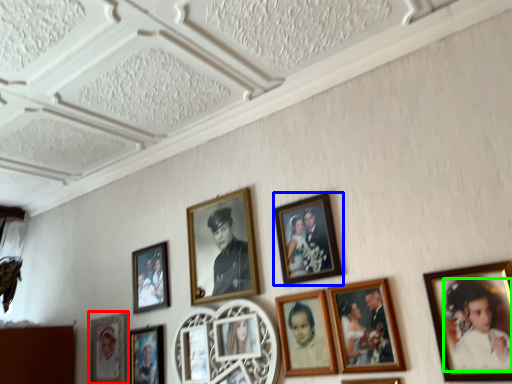
Question: Which object is the closest to the picture frame (highlighted by a red box)? Choose among these: picture frame (highlighted by a blue box) or person (highlighted by a green box).

Choices:
 (A) picture frame
 (B) person

Answer: (A)